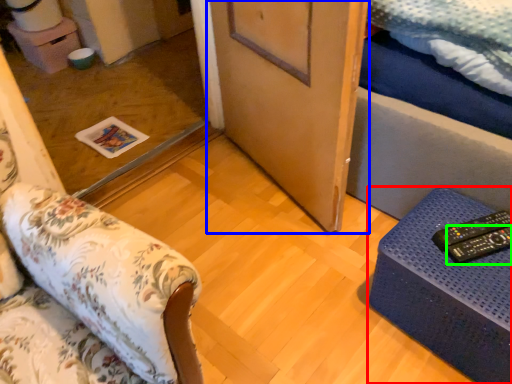
Question: Which object is the farthest from furniture (highlighted by a red box)? Choose among these: door (highlighted by a blue box) or remote (highlighted by a green box).

Choices:
 (A) door
 (B) remote

Answer: (A)